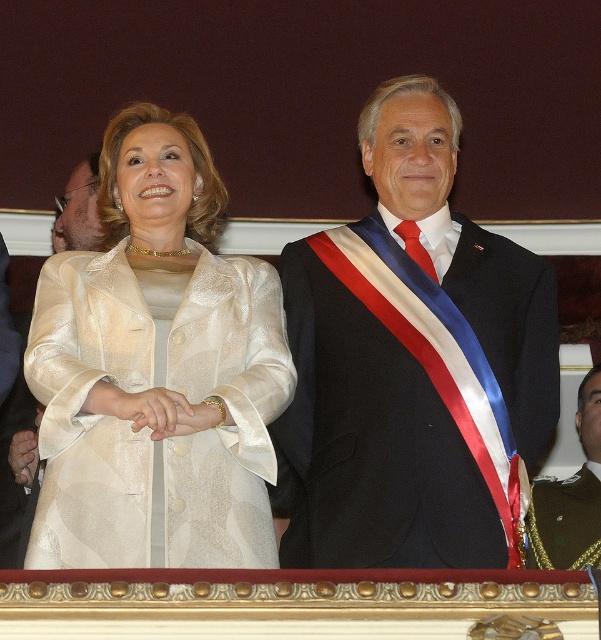
Question: Is ivory silk dress at center further to camera compared to silky beige suit at center?

Choices:
 (A) yes
 (B) no

Answer: (B)

Question: Which object is positioned farthest from the shiny black suit at center?

Choices:
 (A) silky beige suit at center
 (B) green textured uniform at right
 (C) ivory silk dress at center

Answer: (A)

Question: Is silky beige suit at center above green textured uniform at right?

Choices:
 (A) no
 (B) yes

Answer: (B)

Question: Is shiny black suit at center below ivory silk dress at center?

Choices:
 (A) no
 (B) yes

Answer: (A)

Question: Estimate the real-world distances between objects in this image. Which object is closer to the shiny black suit at center?

Choices:
 (A) ivory silk dress at center
 (B) green textured uniform at right

Answer: (A)

Question: Which of these objects is positioned closest to the green textured uniform at right?

Choices:
 (A) shiny black suit at center
 (B) silky beige suit at center
 (C) ivory silk dress at center

Answer: (A)